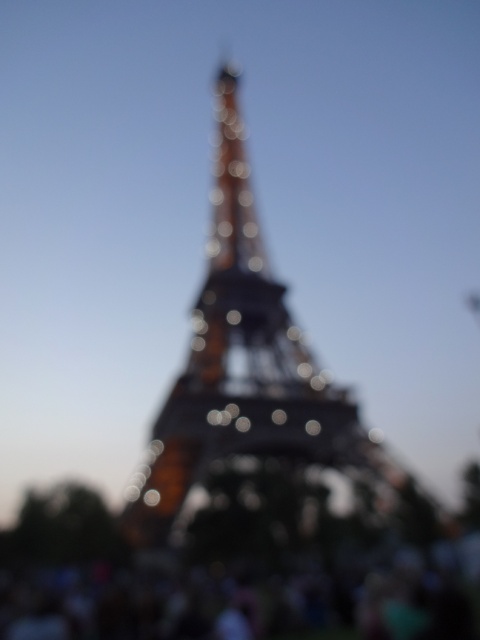
Question: Which of the following is the closest to the observer?

Choices:
 (A) (240, 374)
 (B) (158, 572)

Answer: (B)

Question: Among these points, which one is nearest to the camera?

Choices:
 (A) (312, 588)
 (B) (216, 278)

Answer: (A)

Question: Considering the relative positions of metallic structure at center and blurred crowd at lower center in the image provided, where is metallic structure at center located with respect to blurred crowd at lower center?

Choices:
 (A) left
 (B) right

Answer: (B)

Question: Can you confirm if metallic structure at center is bigger than blurred crowd at lower center?

Choices:
 (A) yes
 (B) no

Answer: (A)

Question: Does metallic structure at center have a larger size compared to blurred crowd at lower center?

Choices:
 (A) yes
 (B) no

Answer: (A)